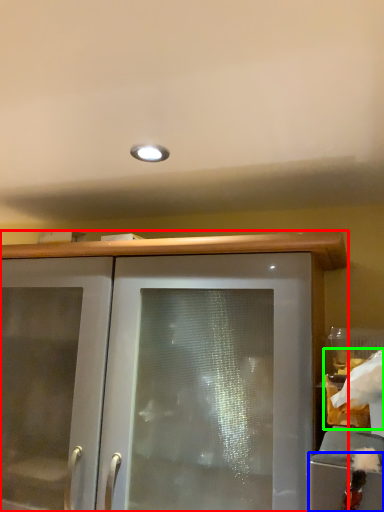
Question: Considering the real-world distances, which object is farthest from cabinetry (highlighted by a red box)? cabinetry (highlighted by a blue box) or food (highlighted by a green box)?

Choices:
 (A) cabinetry
 (B) food

Answer: (A)